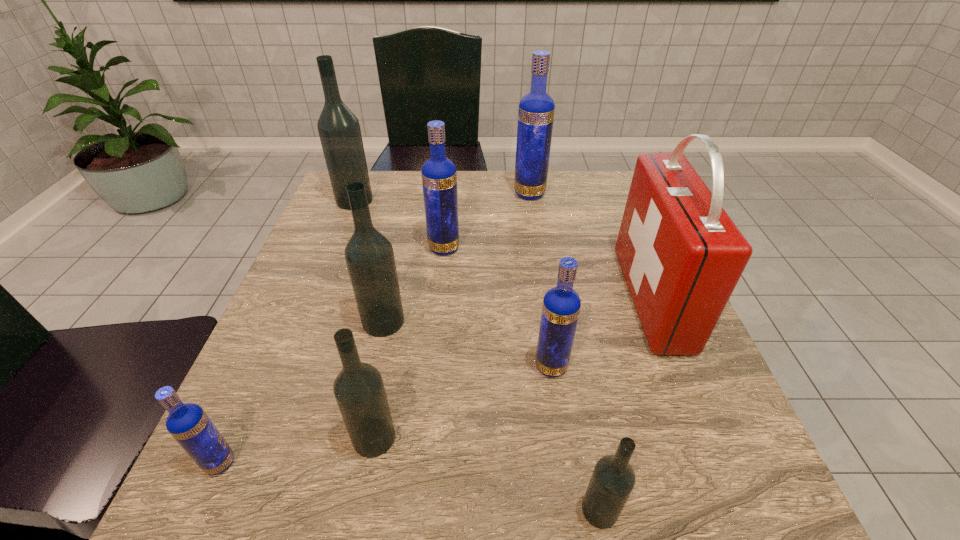
This screenshot has height=540, width=960. I want to click on free space at the far edge of the desktop, so click(489, 182).

What are the coordinates of `free space at the near edge of the desktop` in the screenshot? It's located at [442, 516].

The width and height of the screenshot is (960, 540). What are the coordinates of `vacant area at the left edge of the desktop` in the screenshot? It's located at (312, 302).

In the image, there is a desktop. In order to click on free space at the right edge in this screenshot , I will do `click(596, 249)`.

Identify the location of free region at the near right corner of the desktop. This screenshot has height=540, width=960. (753, 502).

Locate an element on the screen. unoccupied area between the nearest blue vodka and the second biggest black vodka is located at coordinates (301, 392).

You are a GUI agent. You are given a task and a screenshot of the screen. Output one action in this format:
    pyautogui.click(x=<x>, y=<y>)
    Task: Click on the free spot between the smallest blue vodka and the third biggest black vodka
    
    Given the screenshot: What is the action you would take?
    pyautogui.click(x=297, y=450)

This screenshot has width=960, height=540. In order to click on vacant area between the rightmost object and the fourth nearest vodka in this screenshot , I will do `click(601, 333)`.

Locate an element on the screen. This screenshot has height=540, width=960. vacant space that's between the fourth nearest vodka and the second smallest black vodka is located at coordinates (463, 402).

Identify the location of unoccupied position between the second farthest blue vodka and the fourth farthest vodka. The height and width of the screenshot is (540, 960). (414, 285).